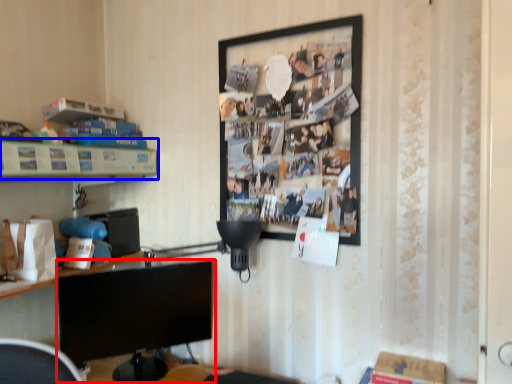
Question: Which of the following is the farthest to the observer, computer monitor (highlighted by a red box) or shelf (highlighted by a blue box)?

Choices:
 (A) computer monitor
 (B) shelf

Answer: (A)